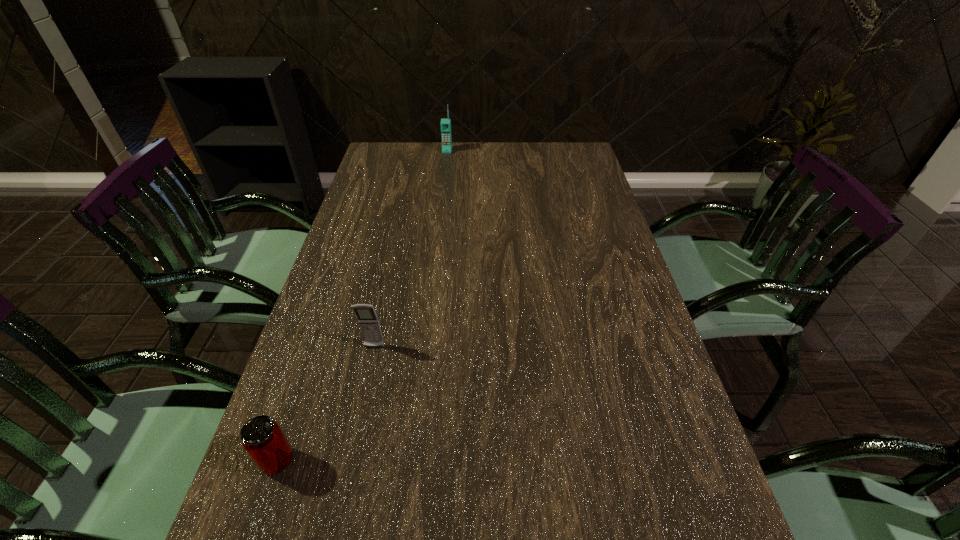
The height and width of the screenshot is (540, 960). I want to click on empty space that is in between the second tallest object and the farthest object, so click(x=411, y=249).

Identify the location of vacant area that lies between the leftmost object and the second object from left to right. (x=325, y=404).

Find the location of a particular element. This screenshot has width=960, height=540. object that is the second closest to the leftmost object is located at coordinates (445, 123).

Identify the location of object that is the closest to the right cellular telephone. Image resolution: width=960 pixels, height=540 pixels. (368, 321).